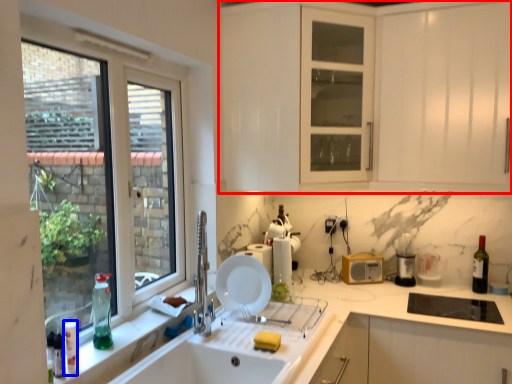
Question: Which point is further to the camera, cabinetry (highlighted by a red box) or bottle (highlighted by a blue box)?

Choices:
 (A) cabinetry
 (B) bottle

Answer: (A)